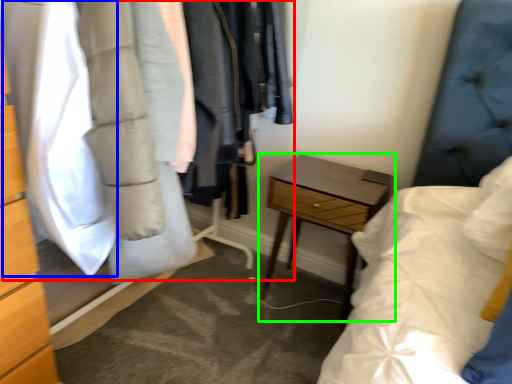
Question: Which object is positioned closest to closet (highlighted by a red box)? Select from clothing (highlighted by a blue box) and nightstand (highlighted by a green box).

Choices:
 (A) clothing
 (B) nightstand

Answer: (A)